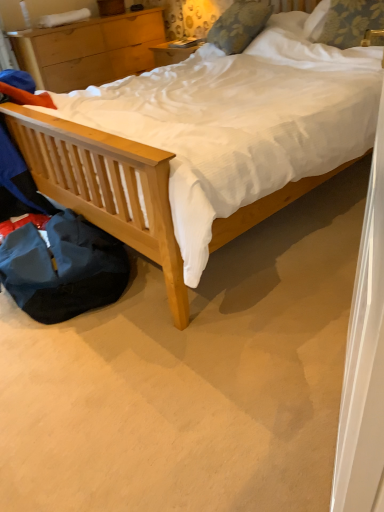
Question: Is light wood nightstand at upper left inside or outside of floral fabric pillow at upper center, marked as the first pillow in a left-to-right arrangement?

Choices:
 (A) outside
 (B) inside

Answer: (A)

Question: Is light wood nightstand at upper left wider or thinner than floral fabric pillow at upper center, marked as the first pillow in a left-to-right arrangement?

Choices:
 (A) wide
 (B) thin

Answer: (A)

Question: Which of these objects is positioned closest to the floral fabric pillow at upper right, arranged as the 2th pillow when viewed from the left?

Choices:
 (A) floral fabric pillow at upper center, the second pillow when ordered from right to left
 (B) light wood nightstand at upper left

Answer: (A)

Question: Which is nearer to the floral fabric pillow at upper right, arranged as the 2th pillow when viewed from the left?

Choices:
 (A) floral fabric pillow at upper center, marked as the first pillow in a left-to-right arrangement
 (B) light wood nightstand at upper left

Answer: (A)